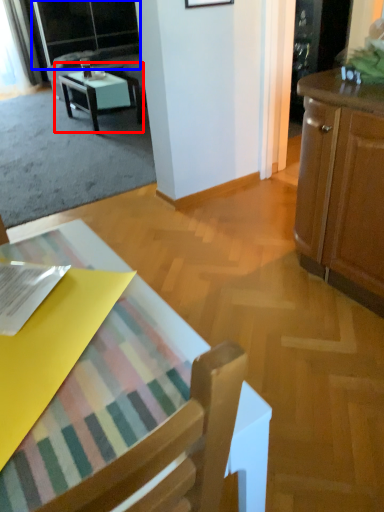
Question: Which object appears closest to the camera in this image, table (highlighted by a red box) or screen door (highlighted by a blue box)?

Choices:
 (A) table
 (B) screen door

Answer: (A)